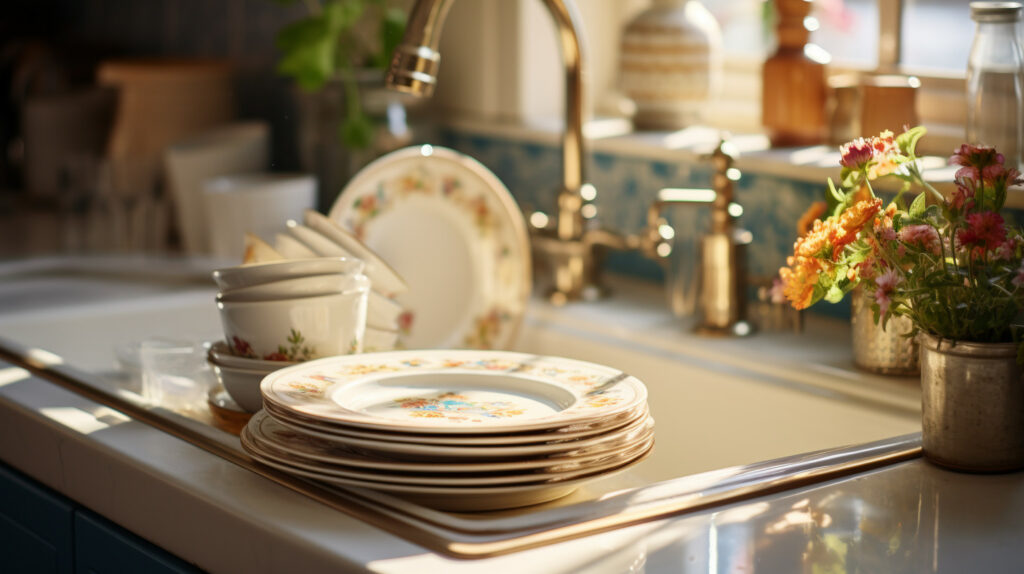
Image resolution: width=1024 pixels, height=574 pixels. What are the coordinates of `plates` in the screenshot? It's located at (450, 272), (454, 402), (479, 444), (454, 451), (438, 470), (431, 480), (428, 492).